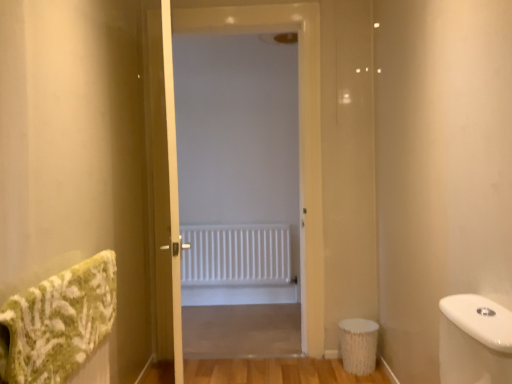
Question: From the image's perspective, is wooden screen door at center beneath white matte radiator at center?

Choices:
 (A) yes
 (B) no

Answer: (B)

Question: Is wooden screen door at center positioned behind white matte radiator at center?

Choices:
 (A) yes
 (B) no

Answer: (B)

Question: Is wooden screen door at center closer to the viewer compared to white matte radiator at center?

Choices:
 (A) no
 (B) yes

Answer: (B)

Question: Is wooden screen door at center bigger than white matte radiator at center?

Choices:
 (A) no
 (B) yes

Answer: (B)

Question: Is wooden screen door at center shorter than white matte radiator at center?

Choices:
 (A) yes
 (B) no

Answer: (B)

Question: From the image's perspective, is wooden screen door at center on top of white matte radiator at center?

Choices:
 (A) yes
 (B) no

Answer: (A)

Question: Is green textured bath towel at left to the left of wooden screen door at center from the viewer's perspective?

Choices:
 (A) yes
 (B) no

Answer: (A)

Question: From a real-world perspective, is green textured bath towel at left under wooden screen door at center?

Choices:
 (A) yes
 (B) no

Answer: (A)

Question: From the image's perspective, is green textured bath towel at left beneath wooden screen door at center?

Choices:
 (A) no
 (B) yes

Answer: (B)

Question: Is green textured bath towel at left aimed at wooden screen door at center?

Choices:
 (A) no
 (B) yes

Answer: (A)

Question: Is green textured bath towel at left at the right side of wooden screen door at center?

Choices:
 (A) no
 (B) yes

Answer: (A)

Question: From the image's perspective, is green textured bath towel at left over wooden screen door at center?

Choices:
 (A) yes
 (B) no

Answer: (B)

Question: Is white matte radiator at center directly adjacent to wooden screen door at center?

Choices:
 (A) yes
 (B) no

Answer: (B)